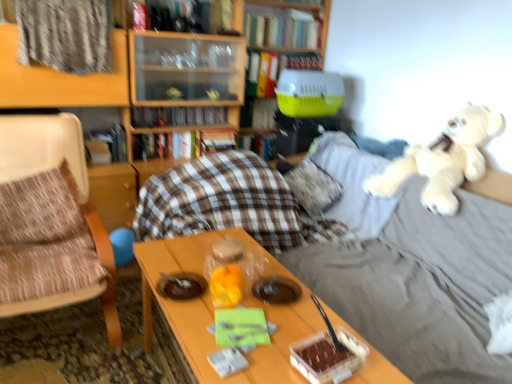
I want to click on free space above hardcover book at center, which is counted as the 8th book, starting from the top (from a real-world perspective), so click(x=185, y=127).